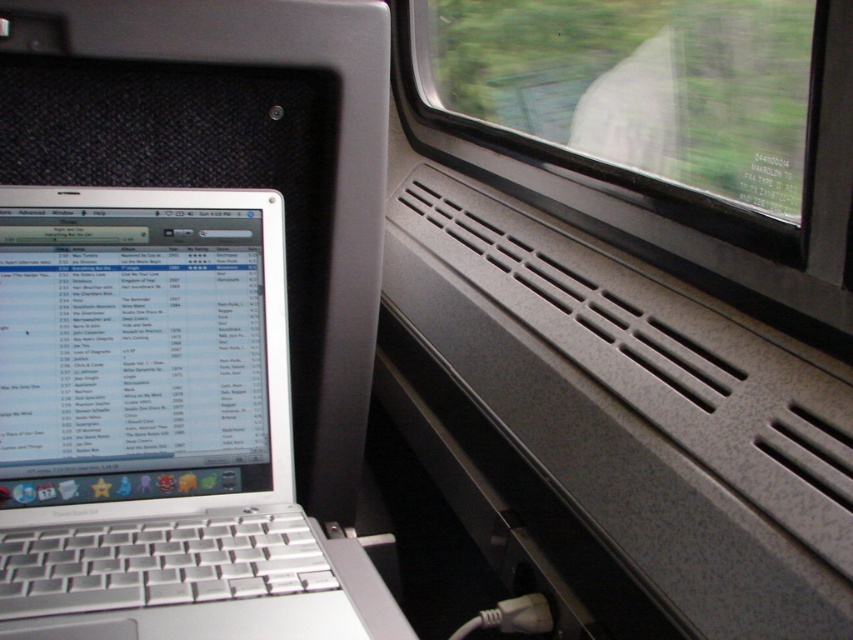
You are a passenger sitting in the train compartment and want to see the view outside through the transparent glass train window at upper center. However, your silver metallic laptop at left is blocking your view. Can you move the laptop to the side to get a better view?

The silver metallic laptop at left is positioned on the left side of the transparent glass train window at upper center. Moving it to the right would allow you to see the view outside the window better.

You are a traveler trying to place a rectangular box that measures 30 inches in length between the silver metallic laptop at left and the transparent glass train window at upper center. Can you fit the box horizontally between them without tilting it?

The silver metallic laptop at left and transparent glass train window at upper center are 31.01 inches apart from each other. Since the box is 30 inches long, it can fit horizontally between them without tilting.

You are a passenger in the train compartment and want to know if you can place a large book between the silver metallic laptop at left and the transparent glass train window at upper center. Based on their sizes, can the book fit there?

The silver metallic laptop at left occupies less space than the transparent glass train window at upper center, so there might be enough space between them to place a large book.